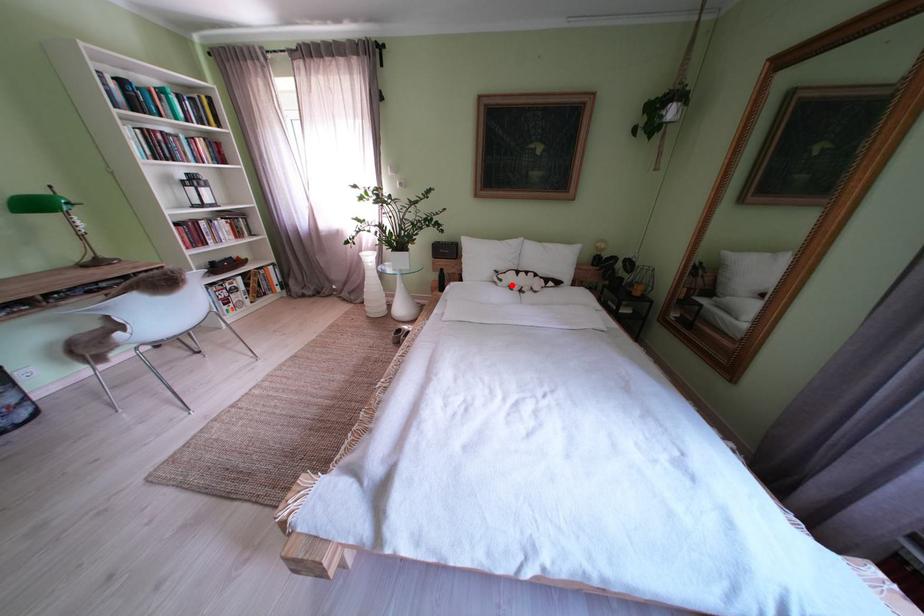
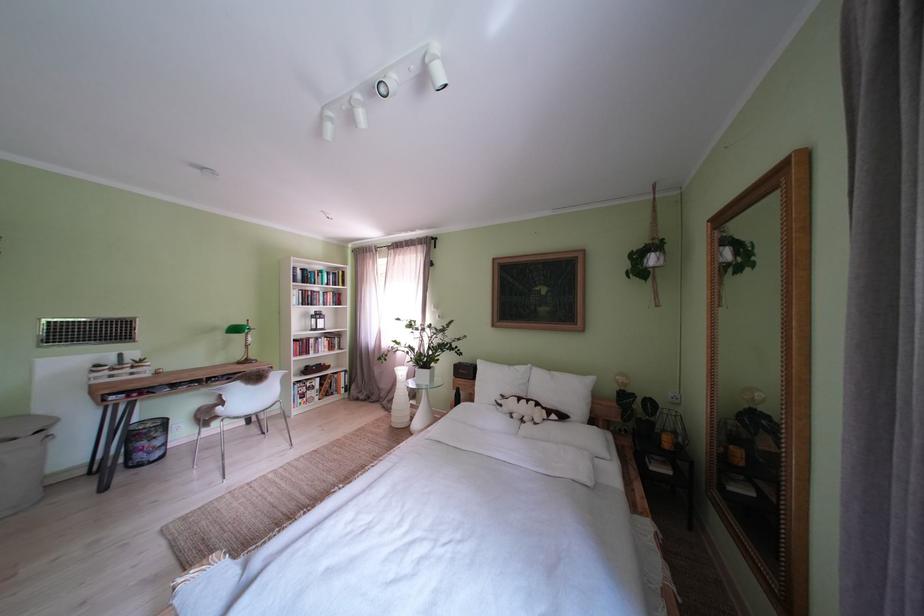
Question: I am providing you with two images of the same scene from different viewpoints. Given a red point in image1, look at the same physical point in image2. Is it:

Choices:
 (A) Closer to the viewpoint
 (B) Farther from the viewpoint

Answer: (B)